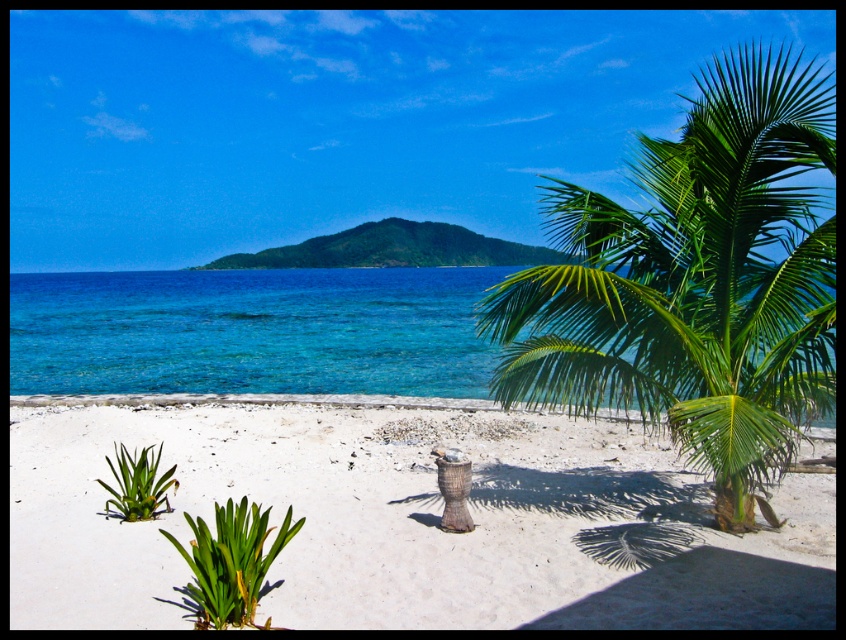
You are a photographer trying to capture the white sandy beach at center and the green leafy palm at center in a single shot. Based on their heights, which object will appear taller in the photo?

The green leafy palm at center appears taller in the photo because it is taller than the white sandy beach at center according to the description.

You are a snorkeler preparing to dive into the clear blue water at center. There is a green leafy palm at center in the way. Can you swim under it without touching it?

The green leafy palm at center is positioned over the clear blue water at center, so yes, you can swim under it without touching it since it is above the water.

You are standing on the beach and want to take a photo of the green leafy palm at center and the clear blue water at center. Which object will appear closer to the camera in the photo?

The green leafy palm at center will appear closer to the camera in the photo because it is positioned in front of the clear blue water at center.